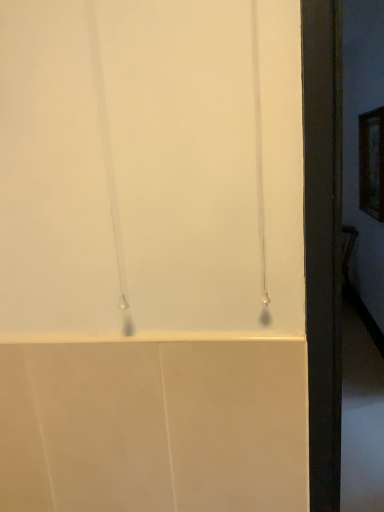
Image resolution: width=384 pixels, height=512 pixels. Describe the element at coordinates (371, 163) in the screenshot. I see `wooden framed picture at right` at that location.

Image resolution: width=384 pixels, height=512 pixels. Identify the location of wooden framed picture at right. (371, 163).

In order to click on wooden framed picture at right in this screenshot , I will do `click(371, 163)`.